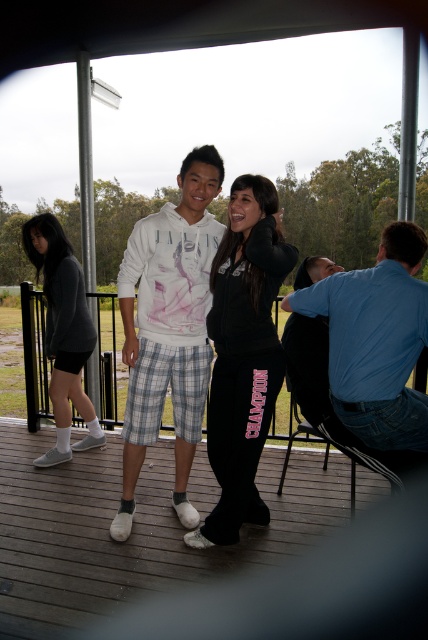
You are planning to place a small potted plant on the deck. Given the sizes of the black fabric deck at center and the blue cotton shirt at right, which object would be more suitable for placing the plant?

The black fabric deck at center is larger in size compared to the blue cotton shirt at right, so the plant should be placed on the black fabric deck at center.

You are a photographer trying to capture a clear photo of both the white cotton hoodie at center and the blue cotton shirt at right. Which one might be partially obscured in the photo and why?

The blue cotton shirt at right might be partially obscured because it is positioned behind the white cotton hoodie at center, making part of it less visible in the photo.